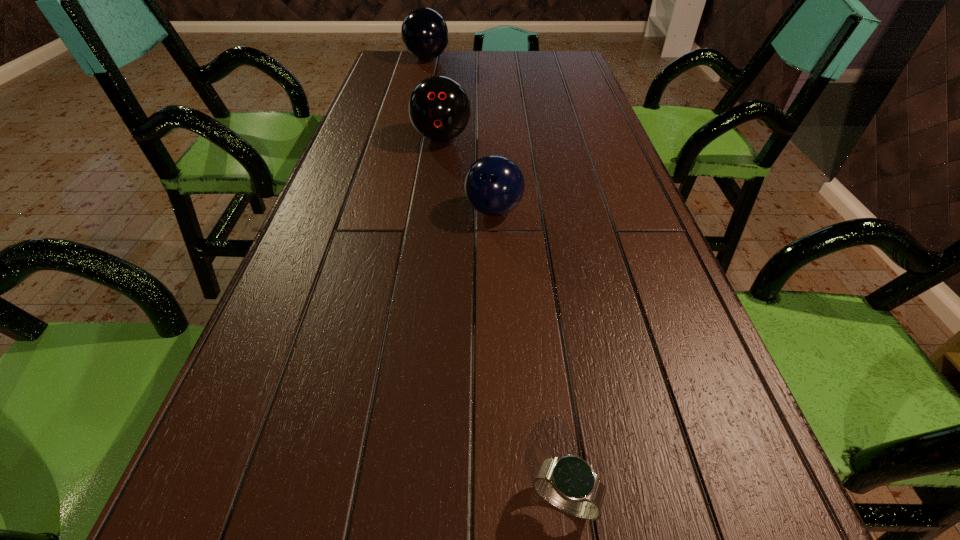
At what (x,y) coordinates should I click in order to perform the action: click on the farthest bowling ball. Please return your answer as a coordinate pair (x, y). The height and width of the screenshot is (540, 960). Looking at the image, I should click on (424, 32).

Image resolution: width=960 pixels, height=540 pixels. I want to click on the third nearest object, so click(439, 108).

Where is `the third tallest object`? This screenshot has width=960, height=540. the third tallest object is located at coordinates (494, 185).

The width and height of the screenshot is (960, 540). I want to click on the third farthest object, so click(494, 185).

Locate an element on the screen. This screenshot has height=540, width=960. the nearest object is located at coordinates (568, 483).

Image resolution: width=960 pixels, height=540 pixels. What are the coordinates of `the shortest object` in the screenshot? It's located at (568, 483).

This screenshot has width=960, height=540. In order to click on free space located 0.160m on the side of the farthest bowling ball with the finger holes in this screenshot , I will do `click(492, 59)`.

Locate an element on the screen. The height and width of the screenshot is (540, 960). vacant region located 0.250m on the surface of the third nearest object near the finger holes is located at coordinates (433, 209).

The width and height of the screenshot is (960, 540). In order to click on free location located on the surface of the nearest bowling ball near the finger holes in this screenshot , I will do `click(498, 350)`.

Identify the location of free space located 0.100m on the back of the shortest object. (553, 409).